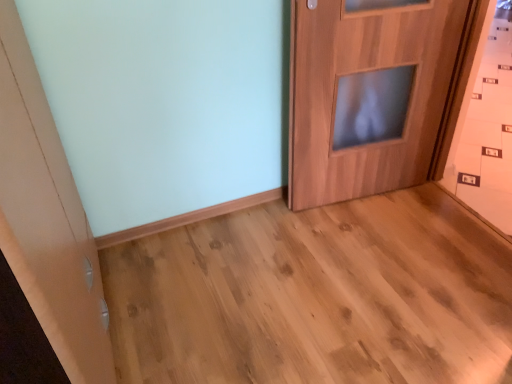
Question: Visually, is natural wood floor at center positioned to the left or to the right of wooden door at center?

Choices:
 (A) right
 (B) left

Answer: (B)

Question: Based on their sizes in the image, would you say natural wood floor at center is bigger or smaller than wooden door at center?

Choices:
 (A) big
 (B) small

Answer: (A)

Question: From a real-world perspective, is natural wood floor at center positioned above or below wooden door at center?

Choices:
 (A) above
 (B) below

Answer: (B)

Question: From the image's perspective, relative to natural wood floor at center, is wooden door at center above or below?

Choices:
 (A) below
 (B) above

Answer: (B)

Question: From a real-world perspective, is wooden door at center positioned above or below natural wood floor at center?

Choices:
 (A) above
 (B) below

Answer: (A)

Question: Looking at their shapes, would you say wooden door at center is wider or thinner than natural wood floor at center?

Choices:
 (A) wide
 (B) thin

Answer: (B)

Question: Is wooden door at center in front of or behind natural wood floor at center in the image?

Choices:
 (A) behind
 (B) front

Answer: (A)